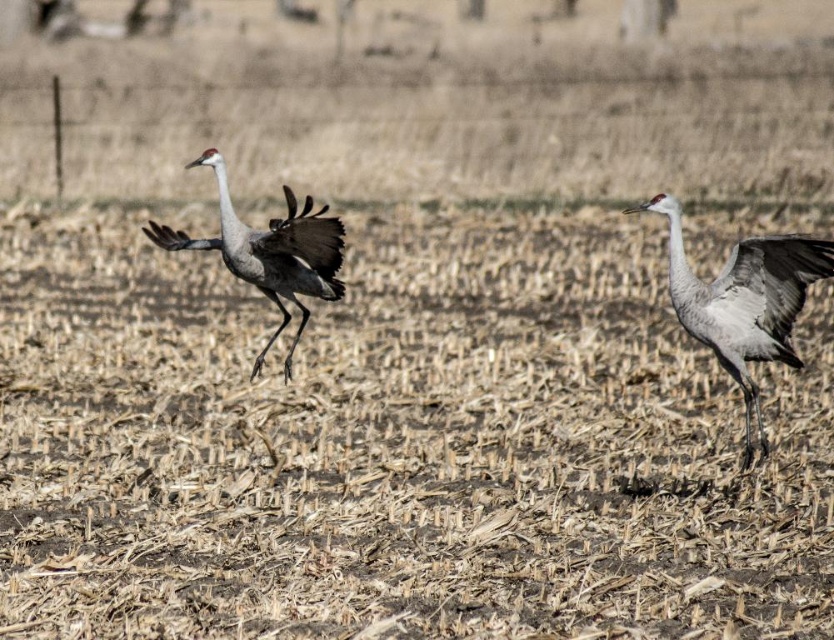
Question: In this image, where is gray feathered crane at right located relative to gray feathered crane at center?

Choices:
 (A) below
 (B) above

Answer: (A)

Question: Which object is closer to the camera taking this photo?

Choices:
 (A) gray feathered crane at right
 (B) gray feathered crane at center

Answer: (B)

Question: From the image, what is the correct spatial relationship of gray feathered crane at right in relation to gray feathered crane at center?

Choices:
 (A) right
 (B) left

Answer: (A)

Question: Can you confirm if gray feathered crane at right is thinner than gray feathered crane at center?

Choices:
 (A) yes
 (B) no

Answer: (A)

Question: Which point is farther from the camera taking this photo?

Choices:
 (A) (312, 285)
 (B) (729, 275)

Answer: (A)